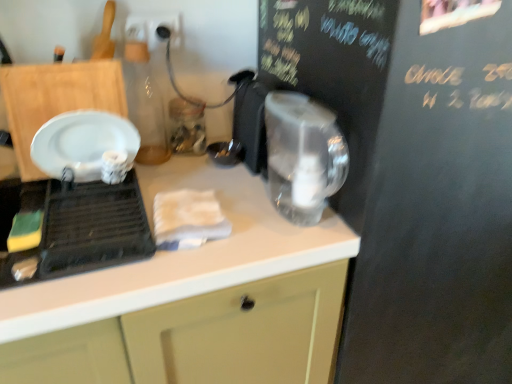
Question: Considering the relative sizes of white glossy plate at left and black chalkboard at upper right in the image provided, is white glossy plate at left bigger than black chalkboard at upper right?

Choices:
 (A) yes
 (B) no

Answer: (B)

Question: Is white glossy plate at left at the left side of black chalkboard at upper right?

Choices:
 (A) no
 (B) yes

Answer: (B)

Question: From a real-world perspective, is white glossy plate at left on top of black chalkboard at upper right?

Choices:
 (A) no
 (B) yes

Answer: (B)

Question: Can you confirm if white glossy plate at left is shorter than black chalkboard at upper right?

Choices:
 (A) yes
 (B) no

Answer: (A)

Question: Can black chalkboard at upper right be found inside white glossy plate at left?

Choices:
 (A) yes
 (B) no

Answer: (B)

Question: Does white glossy plate at left appear on the right side of black chalkboard at upper right?

Choices:
 (A) no
 (B) yes

Answer: (A)

Question: Is white matte countertop at center to the left of white glossy plate at left from the viewer's perspective?

Choices:
 (A) no
 (B) yes

Answer: (A)

Question: From a real-world perspective, is white matte countertop at center positioned under white glossy plate at left based on gravity?

Choices:
 (A) yes
 (B) no

Answer: (A)

Question: Is white matte countertop at center closer to the viewer compared to white glossy plate at left?

Choices:
 (A) yes
 (B) no

Answer: (A)

Question: Can you confirm if white matte countertop at center is positioned to the right of white glossy plate at left?

Choices:
 (A) yes
 (B) no

Answer: (A)

Question: From a real-world perspective, is white matte countertop at center positioned over white glossy plate at left based on gravity?

Choices:
 (A) no
 (B) yes

Answer: (A)

Question: Is white matte countertop at center oriented away from white glossy plate at left?

Choices:
 (A) no
 (B) yes

Answer: (A)

Question: Can you confirm if transparent plastic kettle at center is wider than white matte countertop at center?

Choices:
 (A) no
 (B) yes

Answer: (A)